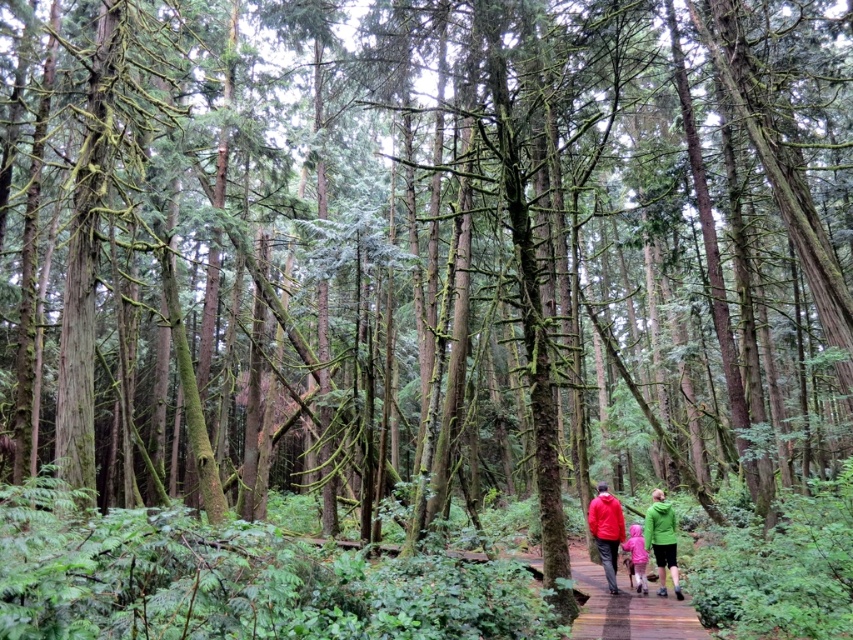
Looking at this image, does matte red jacket at center have a greater height compared to green matte jacket at center?

Correct, matte red jacket at center is much taller as green matte jacket at center.

Does matte red jacket at center appear over green matte jacket at center?

Correct, matte red jacket at center is located above green matte jacket at center.

Between point (596, 509) and point (659, 528), which one is positioned behind?

The point (596, 509) is more distant.

Locate an element on the screen. The width and height of the screenshot is (853, 640). matte red jacket at center is located at coordinates (606, 531).

Who is more forward, (669,506) or (677,593)?

Point (677,593) is more forward.

Which of these two, red matte jacket at center or green matte jacket at center, stands shorter?

Standing shorter between the two is red matte jacket at center.

The image size is (853, 640). I want to click on red matte jacket at center, so click(x=656, y=544).

Which is in front, point (604, 509) or point (640, 580)?

Positioned in front is point (604, 509).

In the scene shown: Can you confirm if matte red jacket at center is smaller than pink fabric at center?

Actually, matte red jacket at center might be larger than pink fabric at center.

Where is `matte red jacket at center`? The image size is (853, 640). matte red jacket at center is located at coordinates (606, 531).

Locate an element on the screen. matte red jacket at center is located at coordinates (606, 531).